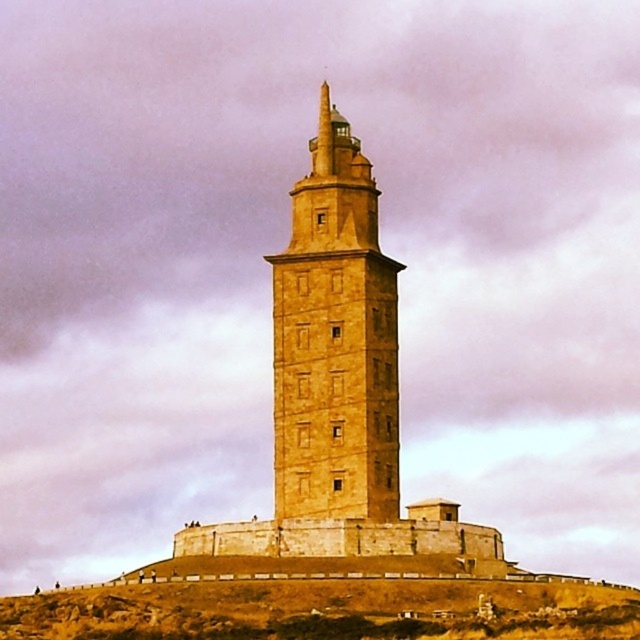
You are an architect evaluating the structural integrity of the golden stone tower at center and the brown stone hillside at center. Based on their sizes, which one might require more reinforcement to withstand strong winds?

The golden stone tower at center is larger in size than the brown stone hillside at center, so it might require more reinforcement to withstand strong winds due to its greater size and potential exposure.

You are standing on the grassy area around the golden stone tower at center. If you walk directly towards the tower, will you reach it before reaching the low wall surrounding the platform?

The golden stone tower at center is positioned at point (333,340), which is closer to the observer than the low wall surrounding the platform. Therefore, you will reach the golden stone tower at center before the low wall.